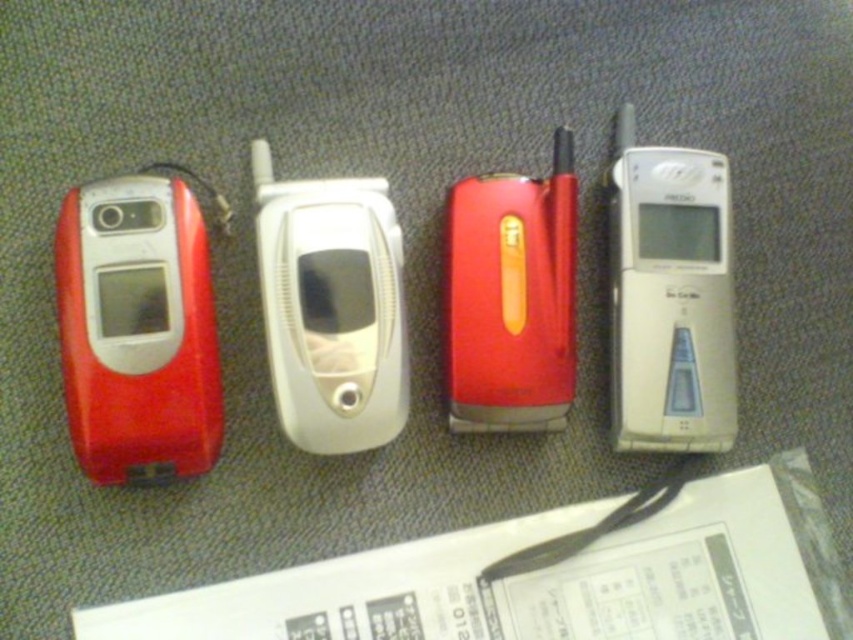
Who is more distant from viewer, (634, 317) or (561, 147)?

Positioned behind is point (561, 147).

Who is more distant from viewer, (672, 268) or (550, 244)?

Positioned behind is point (672, 268).

This screenshot has height=640, width=853. What are the coordinates of `silver metallic phone at right` in the screenshot? It's located at (670, 298).

Who is positioned more to the right, matte red phone at left or silver metallic phone at right?

silver metallic phone at right

Looking at this image, between matte red phone at left and silver metallic phone at right, which one appears on the left side from the viewer's perspective?

matte red phone at left

Who is more forward, (154, 337) or (669, 250)?

Result: Point (154, 337) is in front.

The width and height of the screenshot is (853, 640). I want to click on matte red phone at left, so click(x=138, y=339).

Is silver metallic phone at right behind white glossy flip phone at center?

Yes, it is.

Between silver metallic phone at right and white glossy flip phone at center, which one is positioned lower?

white glossy flip phone at center is lower down.

This screenshot has width=853, height=640. What do you see at coordinates (670, 298) in the screenshot?
I see `silver metallic phone at right` at bounding box center [670, 298].

Where is `silver metallic phone at right`? silver metallic phone at right is located at coordinates (670, 298).